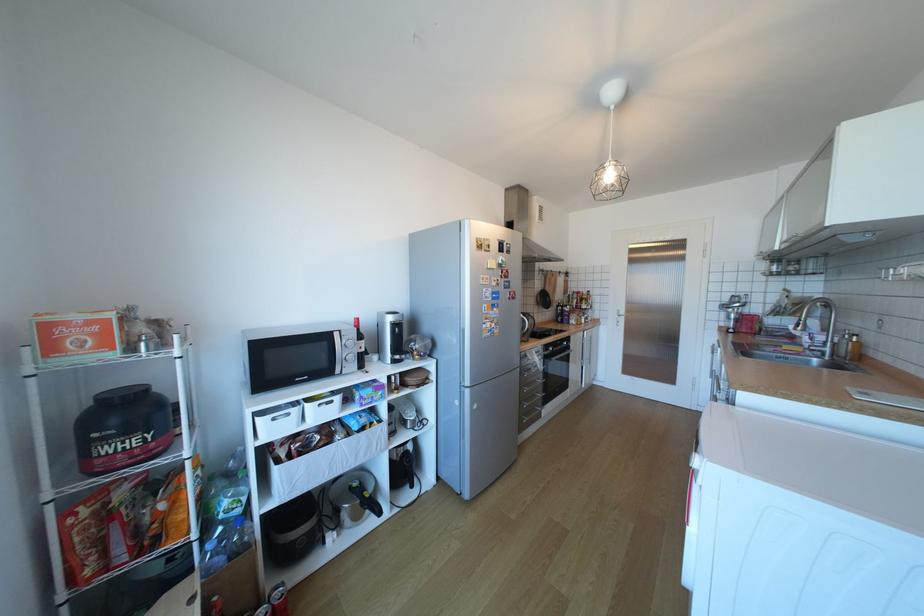
The image size is (924, 616). I want to click on kettle handle, so [x=532, y=320].